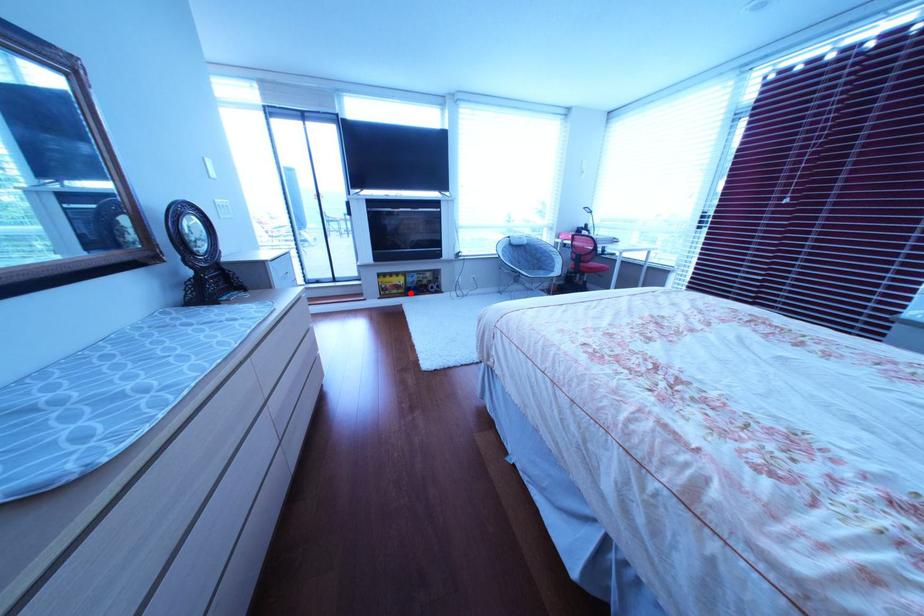
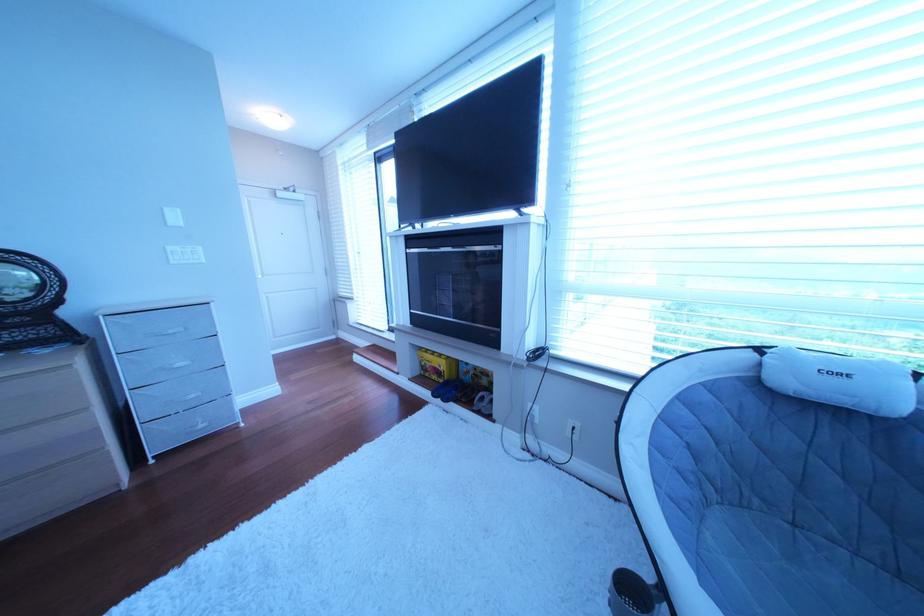
In the second image, find the point that corresponds to the highlighted location in the first image.

(450, 379)